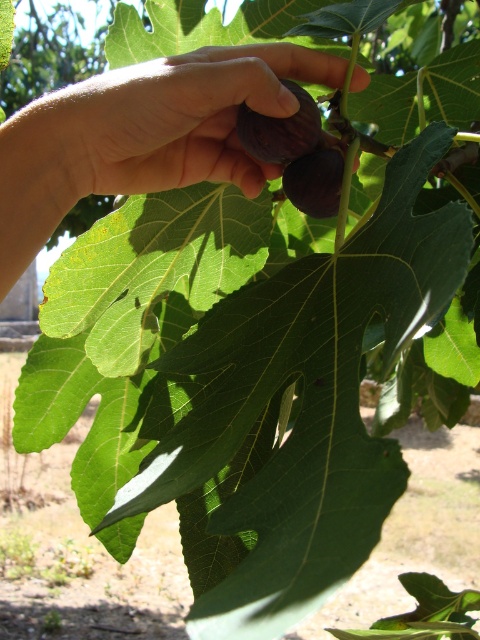
Question: Does purple matte fig at center appear under green matte fig at center?

Choices:
 (A) no
 (B) yes

Answer: (A)

Question: In this image, where is purple matte fig at center located relative to green matte fig at center?

Choices:
 (A) below
 (B) above

Answer: (B)

Question: Which point appears closest to the camera in this image?

Choices:
 (A) [71, 141]
 (B) [319, 180]

Answer: (A)

Question: Which point is farther to the camera?

Choices:
 (A) purple matte fig at center
 (B) matte purple figs at center
 (C) green matte fig at center

Answer: (C)

Question: Estimate the real-world distances between objects in this image. Which object is closer to the matte purple figs at center?

Choices:
 (A) purple matte fig at center
 (B) green matte fig at center

Answer: (A)

Question: From the image, what is the correct spatial relationship of matte purple figs at center in relation to purple matte fig at center?

Choices:
 (A) above
 (B) below

Answer: (B)